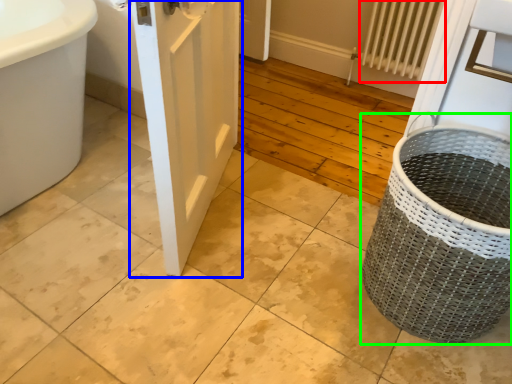
Question: Which is farther away from radiator (highlighted by a red box)? door (highlighted by a blue box) or basket container (highlighted by a green box)?

Choices:
 (A) door
 (B) basket container

Answer: (B)